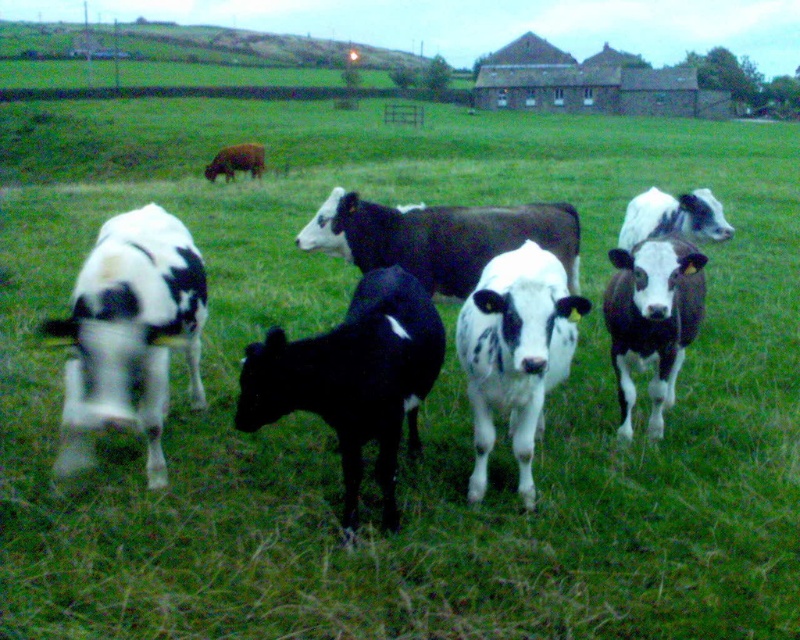
Is black and white cows at center above black smooth calf at center?

Yes, black and white cows at center is above black smooth calf at center.

Describe the element at coordinates (504, 312) in the screenshot. The width and height of the screenshot is (800, 640). I see `black and white cows at center` at that location.

Who is more distant from viewer, (114, 257) or (318, 408)?

The point (114, 257) is more distant.

The image size is (800, 640). What are the coordinates of `black and white cows at center` in the screenshot? It's located at (504, 312).